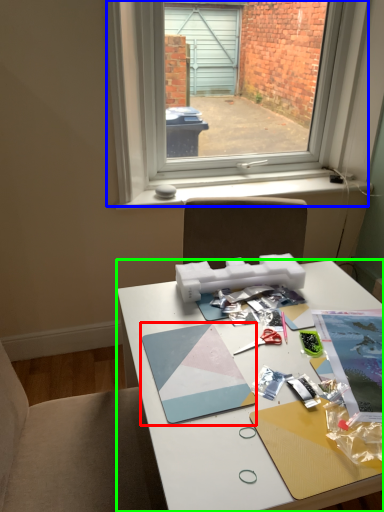
Question: Based on their relative distances, which object is nearer to magazine (highlighted by a red box)? Choose from window (highlighted by a blue box) and desk (highlighted by a green box).

Choices:
 (A) window
 (B) desk

Answer: (B)